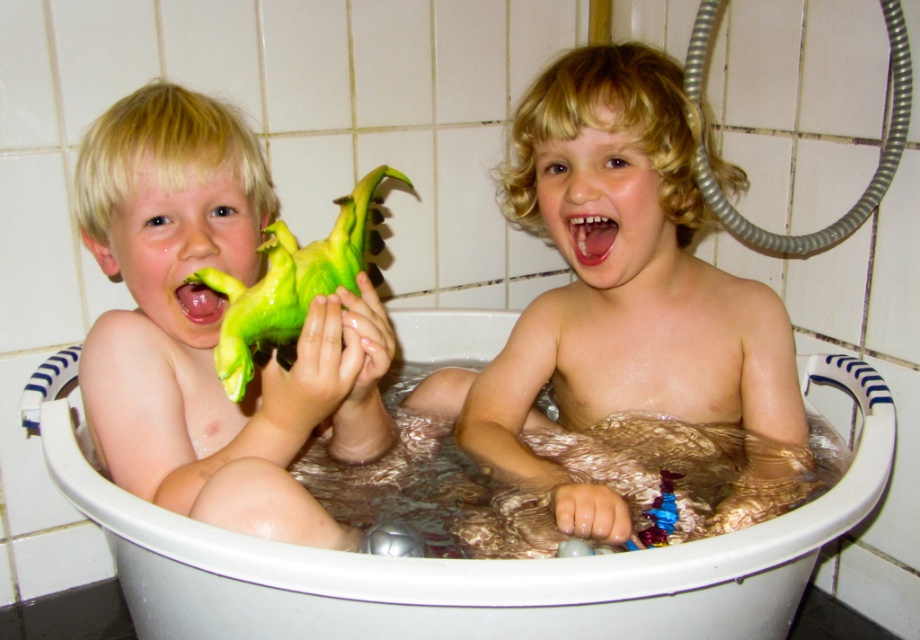
Between white plastic bath at center and bright white teeth at center, which one has less height?

bright white teeth at center

Between point (299, 618) and point (598, 220), which one is positioned behind?

Positioned behind is point (598, 220).

Is point (533, 577) more distant than point (565, 250)?

That is False.

Find the location of a particular element. The height and width of the screenshot is (640, 920). white plastic bath at center is located at coordinates click(460, 560).

Does point (254, 228) lie in front of point (180, 547)?

No, it is not.

In the scene shown: Is green rubber dinosaur at left closer to camera compared to white plastic bath at center?

No.

Is point (169, 109) positioned after point (667, 605)?

Yes, point (169, 109) is behind point (667, 605).

Find the location of a particular element. The width and height of the screenshot is (920, 640). green rubber dinosaur at left is located at coordinates (211, 328).

Can you confirm if green rubber parrot at left is thinner than bright white teeth at center?

In fact, green rubber parrot at left might be wider than bright white teeth at center.

Between point (269, 291) and point (581, 243), which one is positioned in front?

Point (269, 291)

Is point (290, 269) positioned behind point (571, 243)?

No.

This screenshot has height=640, width=920. In order to click on green rubber parrot at left in this screenshot , I will do `click(294, 285)`.